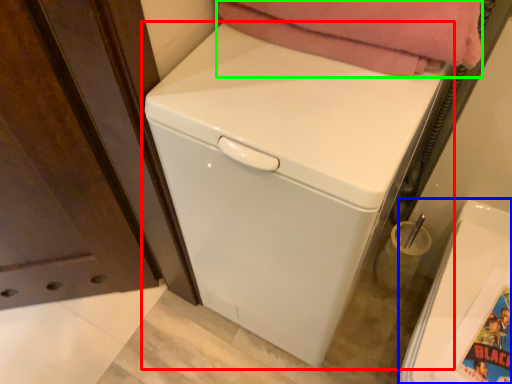
Question: Based on their relative distances, which object is nearer to washing machine (highlighted by a red box)? Choose from washing machine (highlighted by a blue box) and blanket (highlighted by a green box).

Choices:
 (A) washing machine
 (B) blanket

Answer: (B)